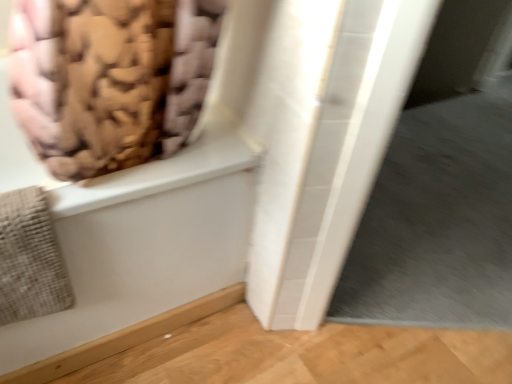
What do you see at coordinates (157, 218) in the screenshot? The image size is (512, 384). I see `fuzzy fabric bathtub at upper left` at bounding box center [157, 218].

Where is `fuzzy fabric bathtub at upper left`? The width and height of the screenshot is (512, 384). fuzzy fabric bathtub at upper left is located at coordinates (157, 218).

You are a GUI agent. You are given a task and a screenshot of the screen. Output one action in this format:
    pyautogui.click(x=<x>, y=<y>)
    Task: Click on the fuzzy fabric bathtub at upper left
    This screenshot has height=384, width=512.
    Given the screenshot: What is the action you would take?
    pyautogui.click(x=157, y=218)